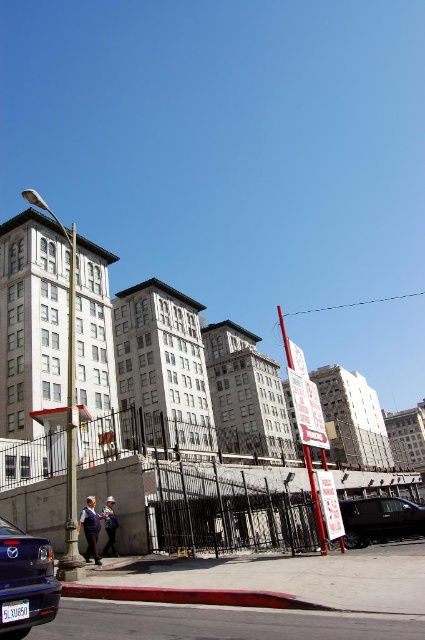
Question: Which object is the closest to the white plastic license plate at lower center?

Choices:
 (A) shiny black van at lower right
 (B) metallic blue sedan at lower left

Answer: (B)

Question: Where is metallic blue sedan at lower left located in relation to white plastic license plate at lower center in the image?

Choices:
 (A) left
 (B) right

Answer: (A)

Question: Which point is farther from the camera taking this photo?

Choices:
 (A) (419, 522)
 (B) (22, 636)
 (C) (11, 620)

Answer: (A)

Question: Does metallic blue sedan at lower left have a greater width compared to white plastic license plate at lower center?

Choices:
 (A) yes
 (B) no

Answer: (B)

Question: Does shiny black van at lower right have a larger size compared to white plastic license plate at lower center?

Choices:
 (A) no
 (B) yes

Answer: (B)

Question: Which of these objects is positioned closest to the shiny black van at lower right?

Choices:
 (A) metallic blue sedan at lower left
 (B) white plastic license plate at lower center

Answer: (B)